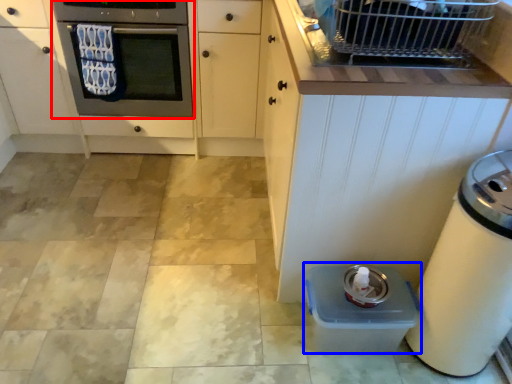
Question: Which of the following is the farthest to the observer, oven (highlighted by a red box) or water cooler (highlighted by a blue box)?

Choices:
 (A) oven
 (B) water cooler

Answer: (A)